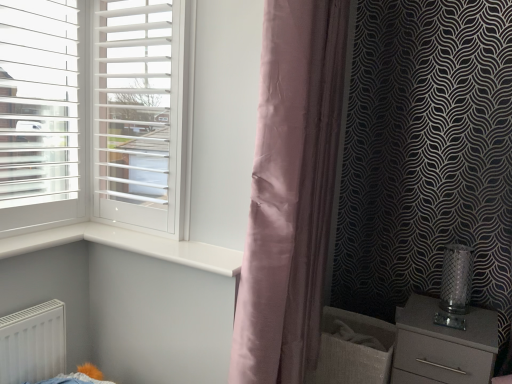
Image resolution: width=512 pixels, height=384 pixels. What do you see at coordinates (129, 246) in the screenshot?
I see `white glossy window sill at center` at bounding box center [129, 246].

In order to face white matte screen door at left, should I rotate leftwards or rightwards?

It's best to rotate left around 15.641 degrees.

Find the location of a particular element. white matte screen door at left is located at coordinates (138, 111).

Where is `satin grey chest of drawers at lower right`? This screenshot has width=512, height=384. satin grey chest of drawers at lower right is located at coordinates (443, 346).

How many degrees apart are the facing directions of silky pink curtain at center and satin grey chest of drawers at lower right?

They differ by 89.3 degrees in their facing directions.

From the image's perspective, is silky pink curtain at center above or below satin grey chest of drawers at lower right?

silky pink curtain at center is situated higher than satin grey chest of drawers at lower right in the image.

Which object is positioned more to the left, silky pink curtain at center or satin grey chest of drawers at lower right?

Positioned to the left is silky pink curtain at center.

Which point is more forward, (335, 96) or (495, 354)?

The point (335, 96) is more forward.

I want to click on chest of drawers to the right of white matte screen door at left, so click(443, 346).

From a real-world perspective, between white matte screen door at left and satin grey chest of drawers at lower right, who is vertically higher?

white matte screen door at left, from a real-world perspective.

How many degrees apart are the facing directions of silky pink curtain at center and white matte screen door at left?

They differ by 89.1 degrees in their facing directions.

Is silky pink curtain at center not inside white matte screen door at left?

Yes, silky pink curtain at center is not within white matte screen door at left.

Is silky pink curtain at center looking in the opposite direction of white matte screen door at left?

That's right, silky pink curtain at center is facing away from white matte screen door at left.

From the image's perspective, which one is positioned lower, silky pink curtain at center or white matte screen door at left?

silky pink curtain at center, from the image's perspective.

Does point (124, 33) come behind point (170, 250)?

Yes, it is.

From the image's perspective, would you say white matte screen door at left is positioned over white glossy window sill at center?

Correct, white matte screen door at left appears higher than white glossy window sill at center in the image.

Is white matte screen door at left situated inside white glossy window sill at center or outside?

white matte screen door at left exists outside the volume of white glossy window sill at center.

Is white glossy window sill at center facing away from white matte screen door at left?

No, white glossy window sill at center is not facing away from white matte screen door at left.

Can we say white glossy window sill at center lies outside white matte screen door at left?

Yes, white glossy window sill at center is not within white matte screen door at left.

Does white glossy window sill at center appear on the left side of white matte screen door at left?

No, white glossy window sill at center is not to the left of white matte screen door at left.

From the image's perspective, is white glossy window sill at center above white matte screen door at left?

No, from the image's perspective, white glossy window sill at center is not over white matte screen door at left.

From a real-world perspective, which object stands above the other?

silky pink curtain at center is physically above.

Which object is positioned more to the left, white glossy window sill at center or silky pink curtain at center?

Positioned to the left is white glossy window sill at center.

Between white glossy window sill at center and silky pink curtain at center, which one has smaller size?

With smaller size is white glossy window sill at center.

From a real-world perspective, is silky pink curtain at center above or below white glossy window sill at center?

silky pink curtain at center is situated higher than white glossy window sill at center in the real world.

Between silky pink curtain at center and white glossy window sill at center, which one appears on the right side from the viewer's perspective?

silky pink curtain at center.

Between silky pink curtain at center and white glossy window sill at center, which one has larger size?

With larger size is silky pink curtain at center.

Is silky pink curtain at center placed right next to white glossy window sill at center?

They are not placed beside each other.

I want to click on curtain on the left of satin grey chest of drawers at lower right, so click(291, 191).

Image resolution: width=512 pixels, height=384 pixels. I want to click on screen door located in front of the satin grey chest of drawers at lower right, so click(138, 111).

Considering their positions, is white matte screen door at left positioned further to white glossy window sill at center than satin grey chest of drawers at lower right?

satin grey chest of drawers at lower right.

Considering their positions, is white glossy window sill at center positioned further to silky pink curtain at center than satin grey chest of drawers at lower right?

Among the two, satin grey chest of drawers at lower right is located further to silky pink curtain at center.

When comparing their distances from white glossy window sill at center, does satin grey chest of drawers at lower right or silky pink curtain at center seem closer?

silky pink curtain at center.

Looking at the image, which one is located further to white glossy window sill at center, white matte screen door at left or silky pink curtain at center?

silky pink curtain at center lies further to white glossy window sill at center than the other object.

Estimate the real-world distances between objects in this image. Which object is closer to silky pink curtain at center, satin grey chest of drawers at lower right or white matte screen door at left?

Based on the image, white matte screen door at left appears to be nearer to silky pink curtain at center.

Based on their spatial positions, is white glossy window sill at center or white matte screen door at left closer to silky pink curtain at center?

white glossy window sill at center.

From the image, which object appears to be farther from satin grey chest of drawers at lower right, white matte screen door at left or silky pink curtain at center?

Based on the image, white matte screen door at left appears to be further to satin grey chest of drawers at lower right.

Which object lies further to the anchor point white glossy window sill at center, silky pink curtain at center or satin grey chest of drawers at lower right?

satin grey chest of drawers at lower right is positioned further to the anchor white glossy window sill at center.

Where is `window sill between white matte screen door at left and silky pink curtain at center in the horizontal direction`? This screenshot has height=384, width=512. window sill between white matte screen door at left and silky pink curtain at center in the horizontal direction is located at coordinates (129, 246).

Where is `curtain located between white glossy window sill at center and satin grey chest of drawers at lower right in the left-right direction`? Image resolution: width=512 pixels, height=384 pixels. curtain located between white glossy window sill at center and satin grey chest of drawers at lower right in the left-right direction is located at coordinates click(x=291, y=191).

At what (x,y) coordinates should I click in order to perform the action: click on window sill situated between white matte screen door at left and satin grey chest of drawers at lower right from left to right. Please return your answer as a coordinate pair (x, y). Looking at the image, I should click on (129, 246).

You are a GUI agent. You are given a task and a screenshot of the screen. Output one action in this format:
    pyautogui.click(x=<x>, y=<y>)
    Task: Click on the curtain between white matte screen door at left and satin grey chest of drawers at lower right
    
    Given the screenshot: What is the action you would take?
    pyautogui.click(x=291, y=191)